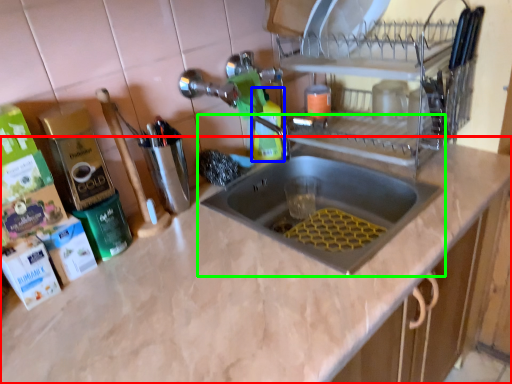
Question: Which object is the farthest from countertop (highlighted by a red box)? Choose among these: cleaning product (highlighted by a blue box) or sink (highlighted by a green box).

Choices:
 (A) cleaning product
 (B) sink

Answer: (A)